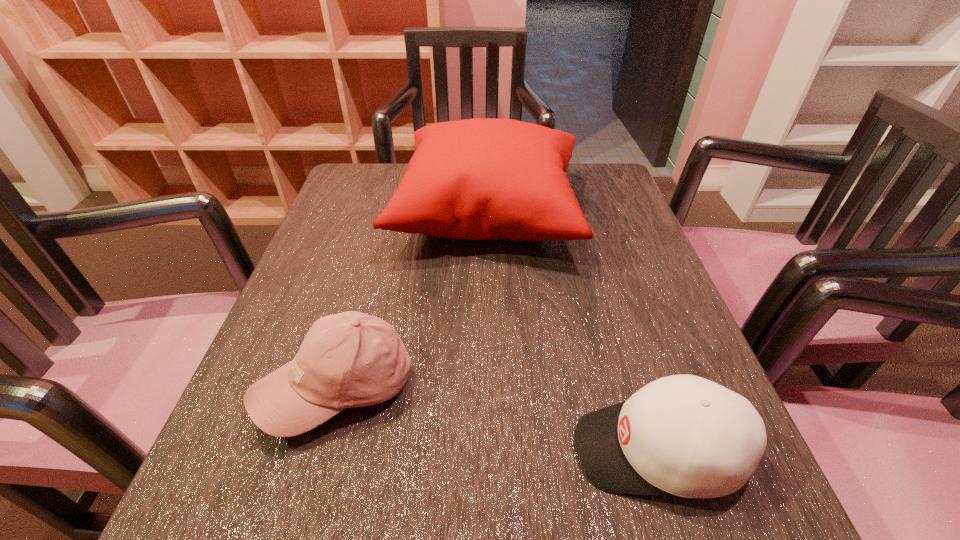
This screenshot has width=960, height=540. What are the coordinates of `vacant space that's between the left baseball cap and the cushion` in the screenshot? It's located at (413, 300).

This screenshot has width=960, height=540. I want to click on free space that is in between the left baseball cap and the right baseball cap, so click(498, 419).

Where is `object identified as the closest to the left baseball cap`? object identified as the closest to the left baseball cap is located at coordinates (475, 179).

Identify which object is the second nearest to the left baseball cap. Please provide its 2D coordinates. Your answer should be formatted as a tuple, i.e. [(x, y)], where the tuple contains the x and y coordinates of a point satisfying the conditions above.

[(682, 435)]